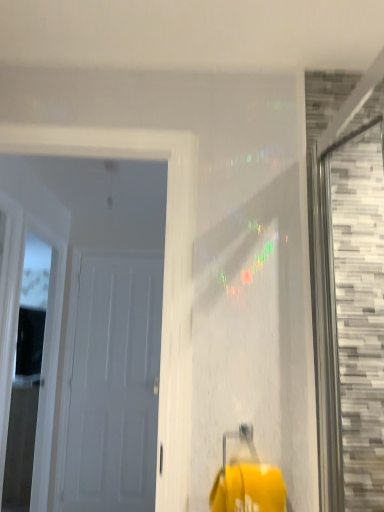
Question: From a real-world perspective, is white matte door at left, the second door in the front-to-back sequence, positioned above or below white wood door at left, the first window positioned from the left?

Choices:
 (A) above
 (B) below

Answer: (B)

Question: Is point (92, 368) positioned closer to the camera than point (21, 283)?

Choices:
 (A) farther
 (B) closer

Answer: (A)

Question: Which of these objects is positioned closest to the white matte door at left, the 1th door in the back-to-front sequence?

Choices:
 (A) white matte door at left, the 1th door in the front-to-back sequence
 (B) gray mosaic tile at right, which is counted as the 2th window, starting from the left
 (C) white wood door at left, the second window positioned from the front

Answer: (C)

Question: Considering the real-world distances, which object is closest to the white matte door at left, acting as the 2th door starting from the back?

Choices:
 (A) white wood door at left, the first window positioned from the left
 (B) gray mosaic tile at right, marked as the first window in a right-to-left arrangement
 (C) white matte door at left, the 1th door in the back-to-front sequence

Answer: (B)